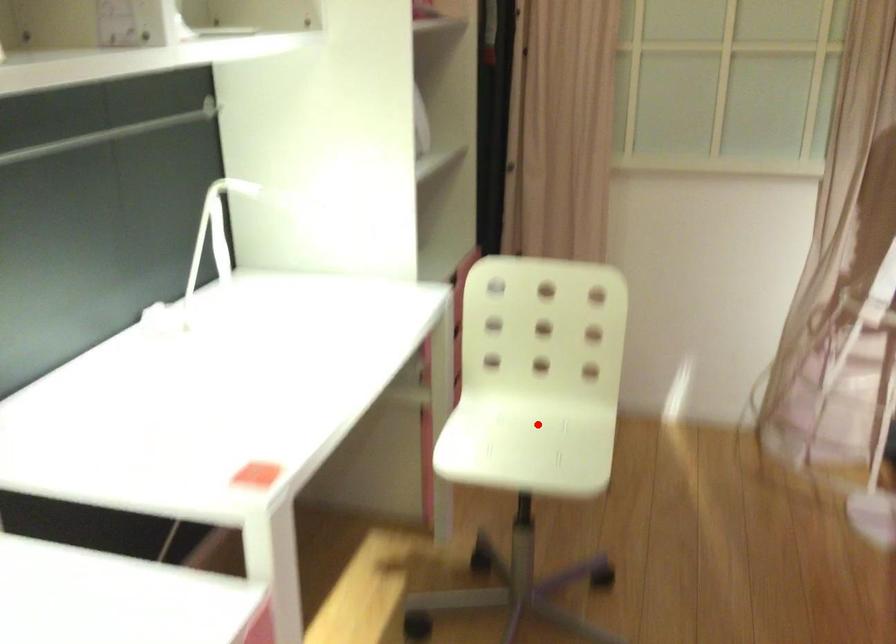
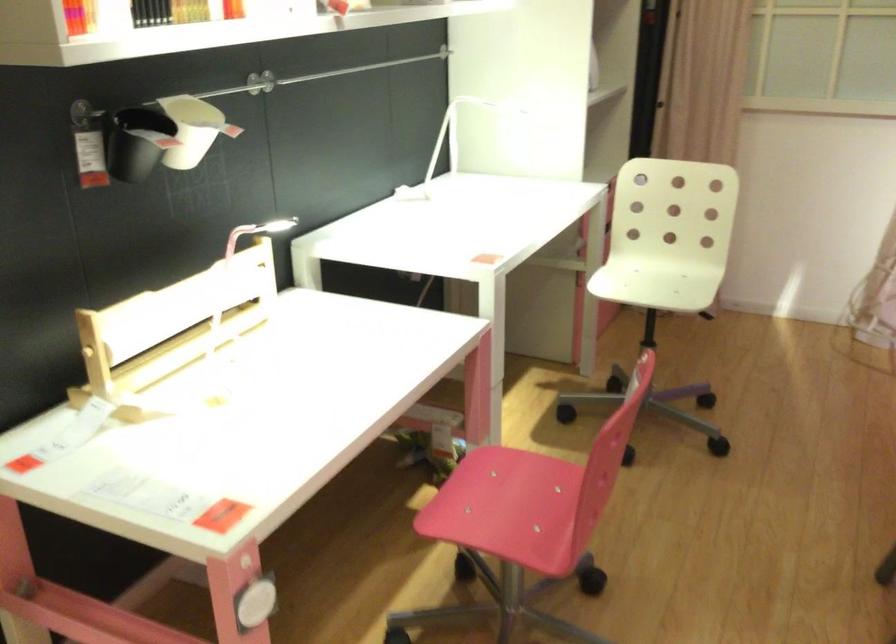
In the second image, find the point that corresponds to the highlighted location in the first image.

(668, 277)